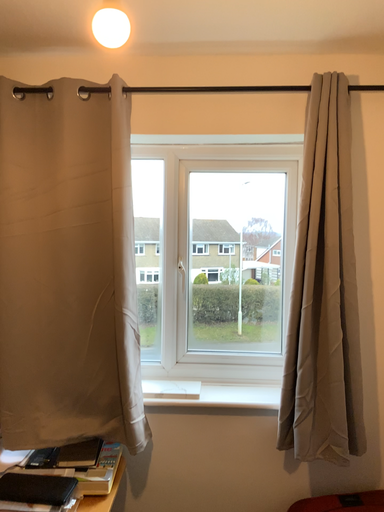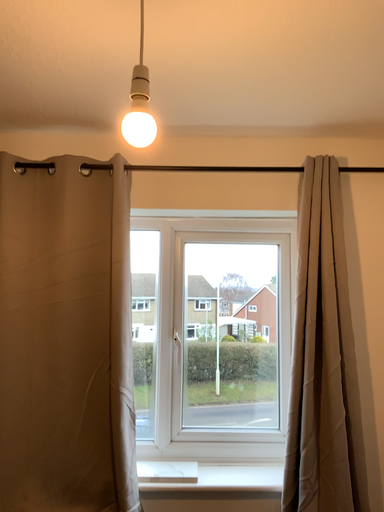
Question: How did the camera likely rotate when shooting the video?

Choices:
 (A) rotated downward
 (B) rotated upward

Answer: (B)